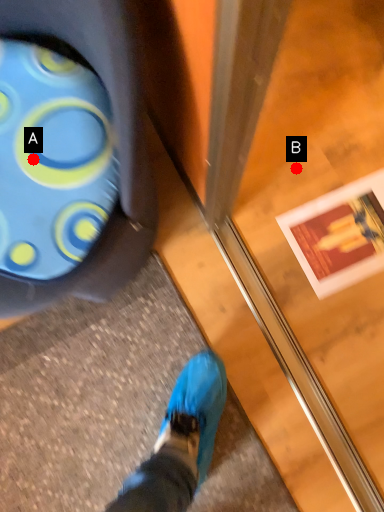
Question: Two points are circled on the image, labeled by A and B beside each circle. Which of the following is the farthest from the observer?

Choices:
 (A) A is further
 (B) B is further

Answer: (B)